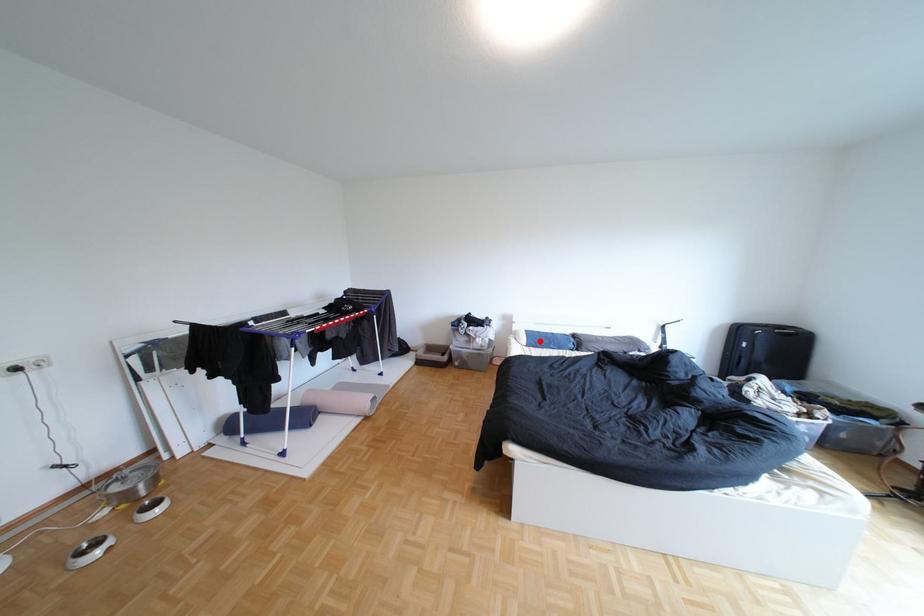
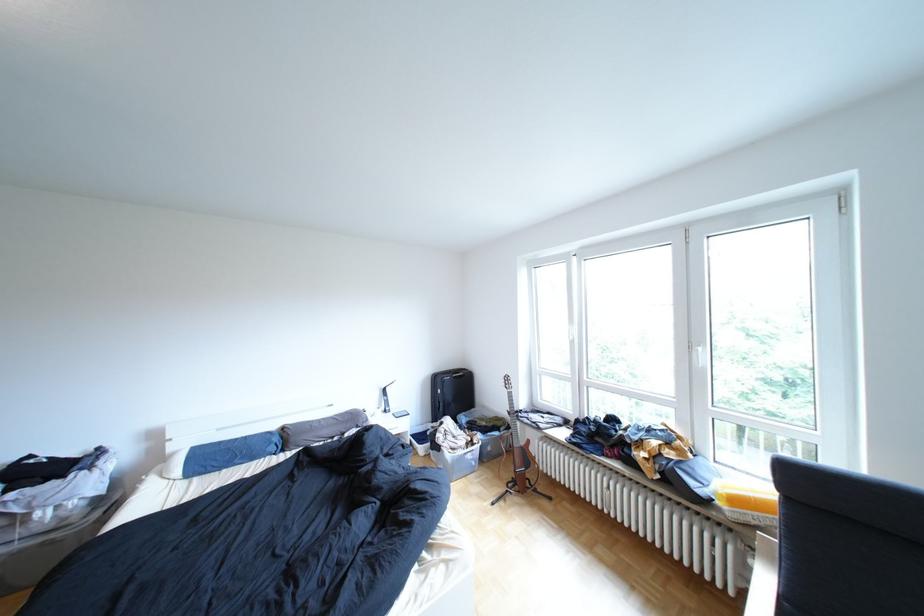
Question: I am providing you with two images of the same scene from different viewpoints. A red point is shown in image1. For the corresponding object point in image2, is it positioned nearer or farther from the camera?

Choices:
 (A) Nearer
 (B) Farther

Answer: (A)